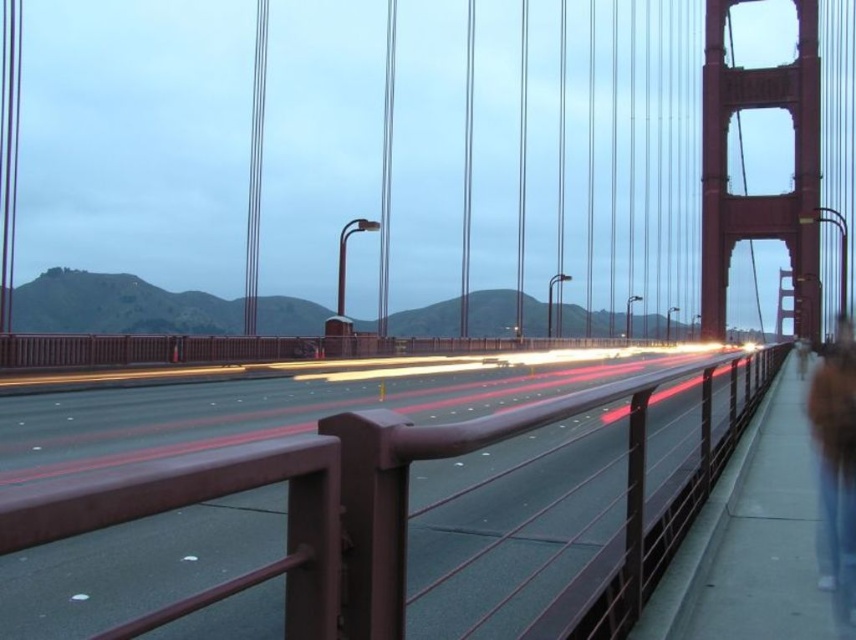
Question: Which point is closer to the camera?

Choices:
 (A) brown fur coat at right
 (B) brown metal railing at center

Answer: (B)

Question: Does brown metal railing at center have a greater width compared to brown fur coat at right?

Choices:
 (A) yes
 (B) no

Answer: (B)

Question: Which point is closer to the camera taking this photo?

Choices:
 (A) (840, 614)
 (B) (687, 422)

Answer: (A)

Question: Among these points, which one is farthest from the camera?

Choices:
 (A) (854, 570)
 (B) (437, 445)

Answer: (A)

Question: Is brown metal railing at center wider than brown fur coat at right?

Choices:
 (A) no
 (B) yes

Answer: (A)

Question: Does brown metal railing at center have a smaller size compared to brown fur coat at right?

Choices:
 (A) yes
 (B) no

Answer: (A)